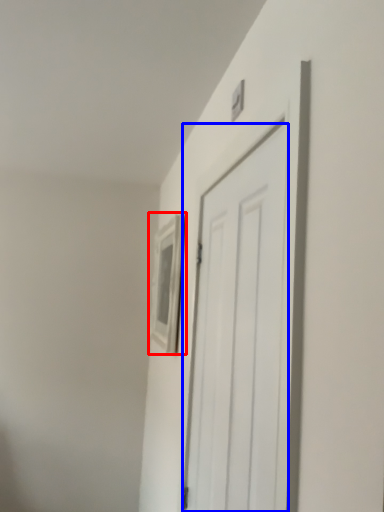
Question: Among these objects, which one is farthest to the camera, picture frame (highlighted by a red box) or door (highlighted by a blue box)?

Choices:
 (A) picture frame
 (B) door

Answer: (A)